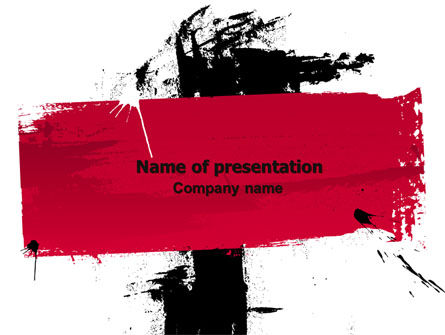
This screenshot has height=335, width=445. In order to click on white empty spaces in the corners in this screenshot , I will do `click(75, 54)`, `click(384, 42)`, `click(339, 295)`, `click(80, 310)`.